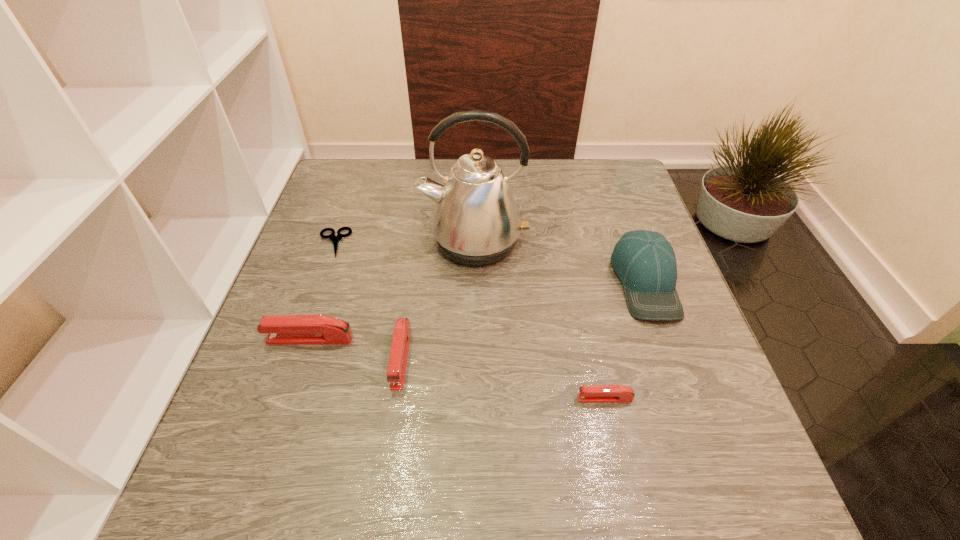
Where is `vacant space at the far edge`? vacant space at the far edge is located at coordinates (555, 164).

Find the location of a particular element. free spot at the left edge of the desktop is located at coordinates (320, 279).

In the image, there is a desktop. Identify the location of vacant space at the right edge. (617, 211).

Locate an element on the screen. The width and height of the screenshot is (960, 540). vacant space at the far left corner of the desktop is located at coordinates tap(324, 200).

The image size is (960, 540). Identify the location of vacant region at the far right corner of the desktop. (608, 191).

This screenshot has width=960, height=540. Find the location of `vacant area that lies between the second stapler from right to left and the shortest stapler`. vacant area that lies between the second stapler from right to left and the shortest stapler is located at coordinates (503, 378).

Find the location of a particular element. unoccupied position between the nearest stapler and the rightmost object is located at coordinates (625, 340).

Identify the location of vacant point located between the nearest object and the kettle. (540, 320).

Image resolution: width=960 pixels, height=540 pixels. In order to click on free space between the kettle and the leftmost stapler in this screenshot , I will do `click(392, 291)`.

In order to click on free spot between the fourth tallest object and the leftmost stapler in this screenshot , I will do `click(355, 348)`.